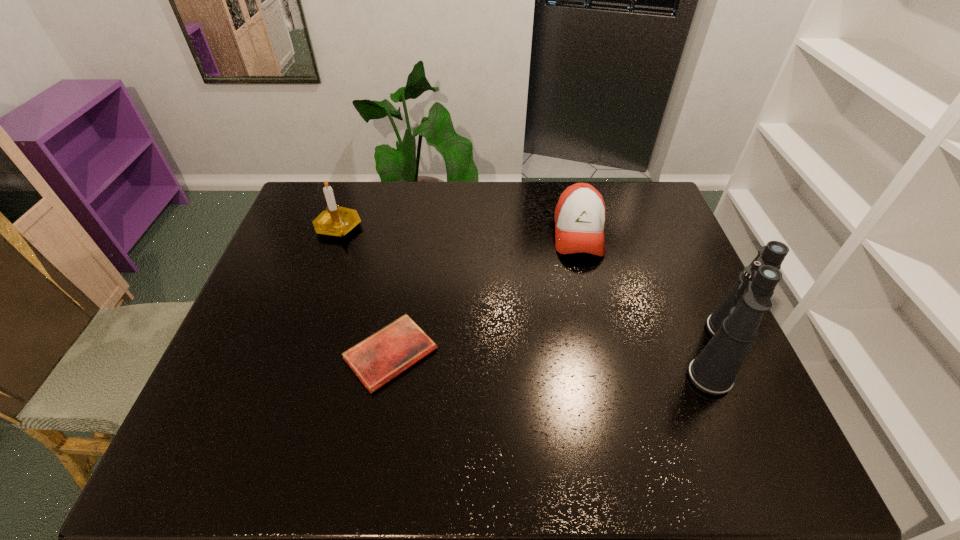
Where is `the third object from right to left`? The width and height of the screenshot is (960, 540). the third object from right to left is located at coordinates (379, 358).

Locate an element on the screen. the shortest object is located at coordinates (379, 358).

Identify the location of the tallest object. (733, 326).

At what (x,y) coordinates should I click in order to perform the action: click on the rightmost object. Please return your answer as a coordinate pair (x, y). This screenshot has height=540, width=960. Looking at the image, I should click on (733, 326).

Find the location of a particular element. Image resolution: width=960 pixels, height=540 pixels. baseball cap is located at coordinates (580, 214).

In order to click on the third tallest object in this screenshot , I will do `click(580, 214)`.

Image resolution: width=960 pixels, height=540 pixels. I want to click on the leftmost object, so click(336, 221).

At what (x,y) coordinates should I click in order to perform the action: click on the third shortest object. Please return your answer as a coordinate pair (x, y). Image resolution: width=960 pixels, height=540 pixels. Looking at the image, I should click on point(336,221).

Locate an element on the screen. free space located on the left of the second object from left to right is located at coordinates (300, 354).

This screenshot has height=540, width=960. I want to click on vacant area situated 0.160m on the back of the binoculars, so click(683, 273).